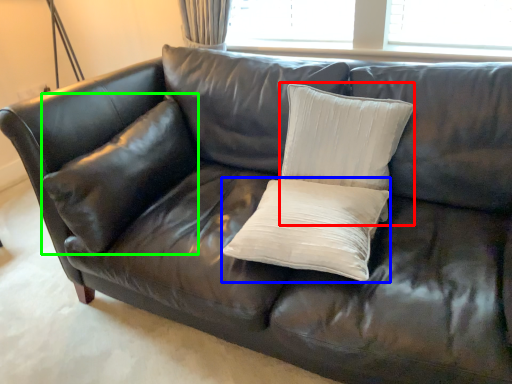
Question: Considering the real-world distances, which object is closest to pillow (highlighted by a red box)? pillow (highlighted by a blue box) or pillow (highlighted by a green box).

Choices:
 (A) pillow
 (B) pillow

Answer: (A)